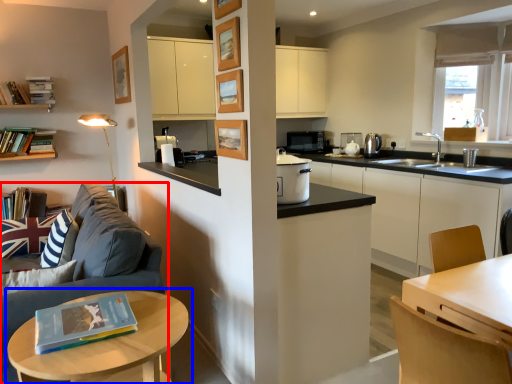
Question: Which object appears closest to the camera in this image, studio couch (highlighted by a red box) or table (highlighted by a blue box)?

Choices:
 (A) studio couch
 (B) table

Answer: (B)